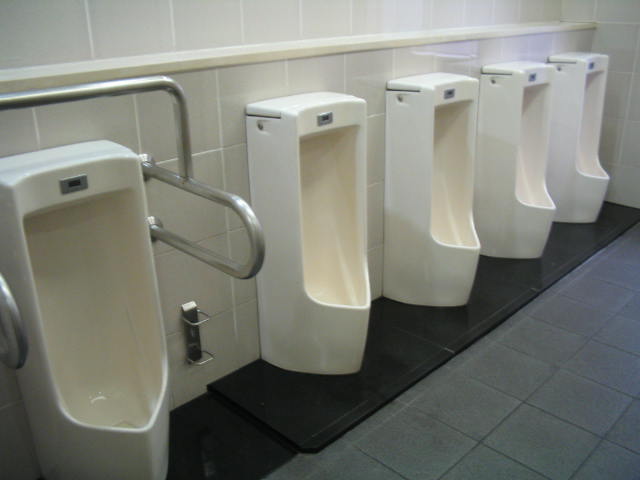
At what (x,y) coordinates should I click in order to perform the action: click on bathroom urinals. Please return your answer as a coordinate pair (x, y). The height and width of the screenshot is (480, 640). Looking at the image, I should click on (89, 255), (317, 200), (438, 168), (582, 116), (518, 140).